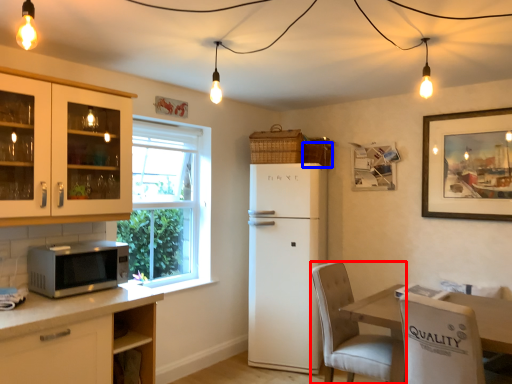
Question: Which object is closer to the camera taking this photo, chair (highlighted by a red box) or basket (highlighted by a blue box)?

Choices:
 (A) chair
 (B) basket

Answer: (A)